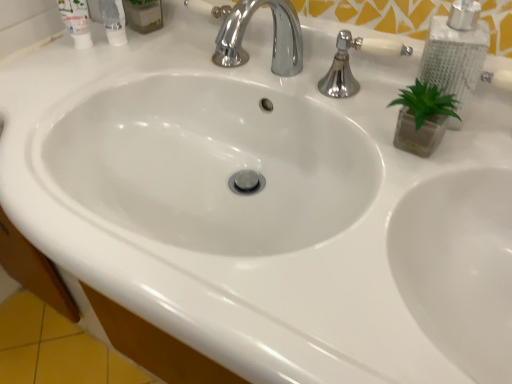
The height and width of the screenshot is (384, 512). What are the coordinates of `vacant space in front of polished chrome faucet at upper center` in the screenshot? It's located at (385, 160).